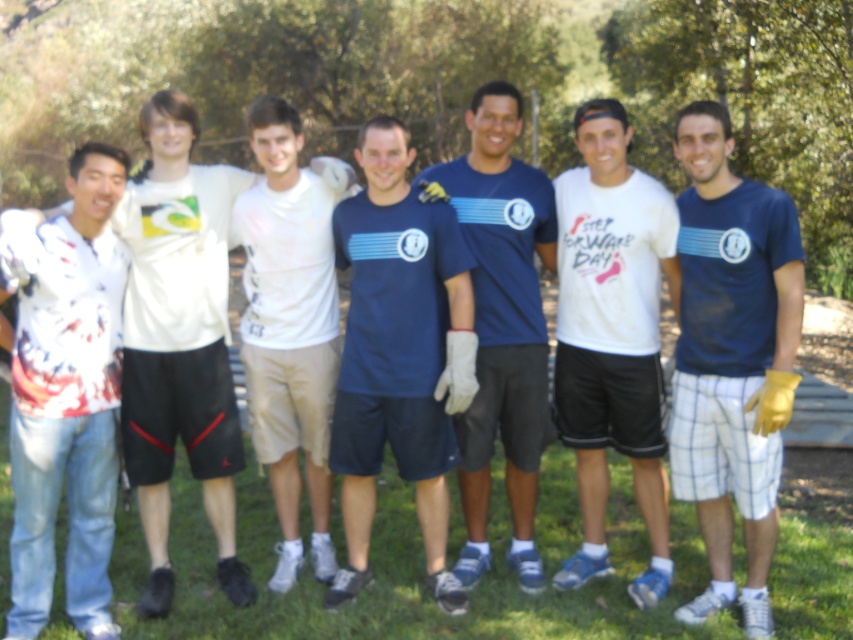
Which is in front, point (747, 234) or point (320, 296)?

Point (747, 234) is in front.

Does blue fabric shirt at center appear over white cotton t-shirt at center?

No, blue fabric shirt at center is not above white cotton t-shirt at center.

Is point (728, 291) positioned after point (302, 416)?

No, (728, 291) is in front of (302, 416).

Identify the location of blue fabric shirt at center. The image size is (853, 640). (730, 356).

Is the position of white cotton shirt at left less distant than that of matte blue t-shirt at center?

Yes, white cotton shirt at left is in front of matte blue t-shirt at center.

Consider the image. Is white cotton shirt at left smaller than matte blue t-shirt at center?

Incorrect, white cotton shirt at left is not smaller in size than matte blue t-shirt at center.

You are a GUI agent. You are given a task and a screenshot of the screen. Output one action in this format:
    pyautogui.click(x=<x>, y=<y>)
    Task: Click on the white cotton shirt at left
    Image resolution: width=853 pixels, height=640 pixels.
    Given the screenshot: What is the action you would take?
    pyautogui.click(x=178, y=340)

Between printed cotton shirt at left and matte blue shirt at center, which one appears on the left side from the viewer's perspective?

printed cotton shirt at left

Measure the distance between point (56, 252) and camera.

Point (56, 252) and camera are 4.06 meters apart from each other.

Between point (100, 412) and point (480, 284), which one is positioned in front?

Point (100, 412) is more forward.

Find the location of `printed cotton shirt at left`. printed cotton shirt at left is located at coordinates (67, 396).